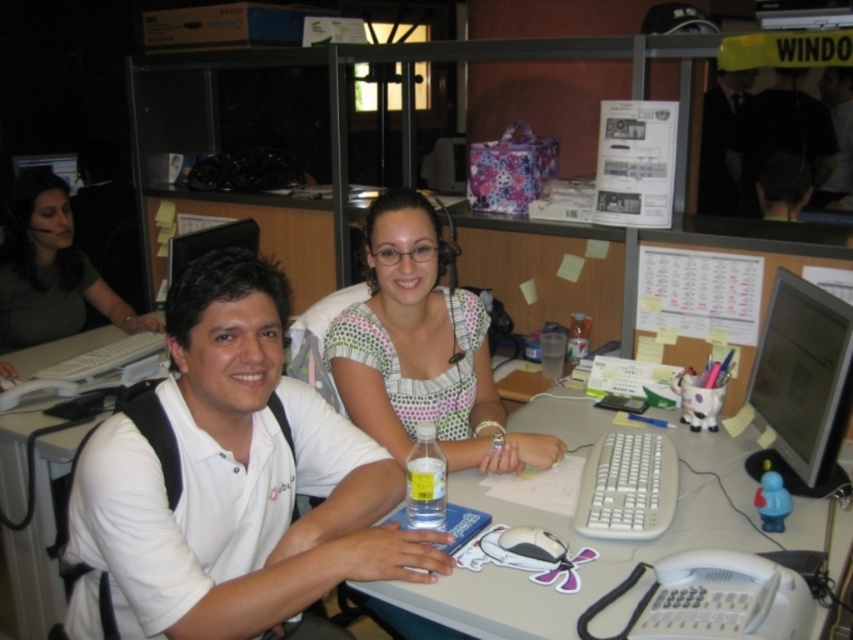
Does point (682, 428) come behind point (3, 420)?

No, it is in front of (3, 420).

Is white plastic keyboard at center smaller than white plastic table at center?

Yes.

Identify the location of white plastic keyboard at center. (570, 548).

Can you confirm if polka dot blouse at center is smaller than matte black monitor at right?

Actually, polka dot blouse at center might be larger than matte black monitor at right.

The image size is (853, 640). In order to click on polka dot blouse at center in this screenshot , I will do `click(422, 349)`.

Does white matte shirt at center appear under matte green shirt at left?

Correct, white matte shirt at center is located below matte green shirt at left.

Can you confirm if white matte shirt at center is positioned to the left of matte green shirt at left?

No, white matte shirt at center is not to the left of matte green shirt at left.

Which is in front, point (108, 474) or point (24, 236)?

Positioned in front is point (108, 474).

This screenshot has width=853, height=640. In order to click on white matte shirt at center in this screenshot , I will do `click(236, 477)`.